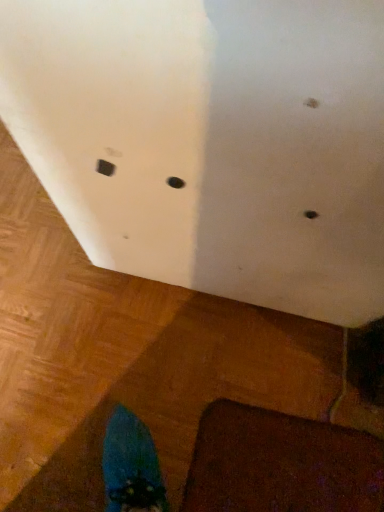
The width and height of the screenshot is (384, 512). In order to click on brown felt mat at lower center in this screenshot , I will do (x=281, y=464).

What is the approximate width of brown felt mat at lower center?

brown felt mat at lower center is 15.63 inches wide.

The image size is (384, 512). What do you see at coordinates (281, 464) in the screenshot? I see `brown felt mat at lower center` at bounding box center [281, 464].

Find the location of a particular element. This screenshot has height=512, width=384. brown felt mat at lower center is located at coordinates (281, 464).